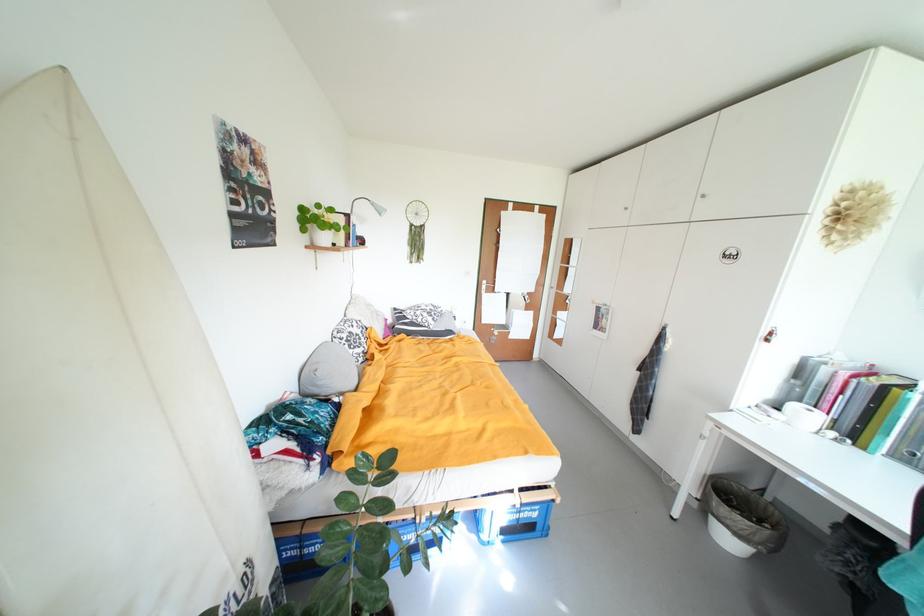
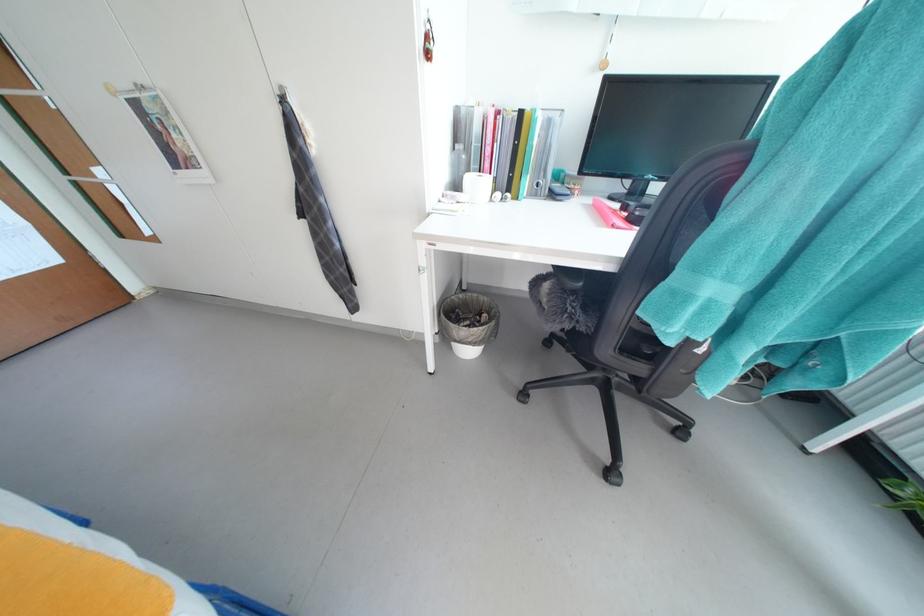
Locate, in the second image, the point that corresponds to (x=772, y=334) in the first image.

(428, 41)